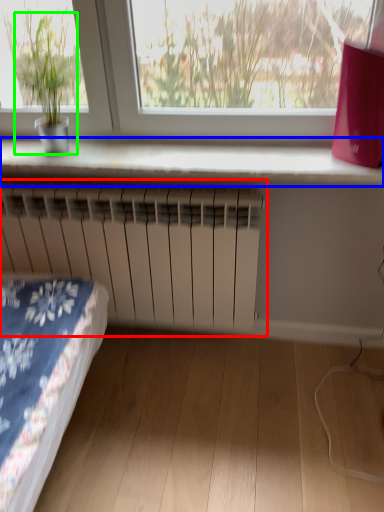
Question: Which is nearer to the radiator (highlighted by a red box)? window sill (highlighted by a blue box) or houseplant (highlighted by a green box).

Choices:
 (A) window sill
 (B) houseplant

Answer: (A)